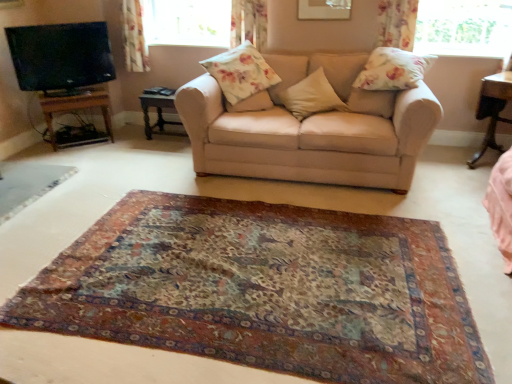
Identify the location of free location to the right of wooden table at left, the 1th table positioned from the left. The height and width of the screenshot is (384, 512). (126, 142).